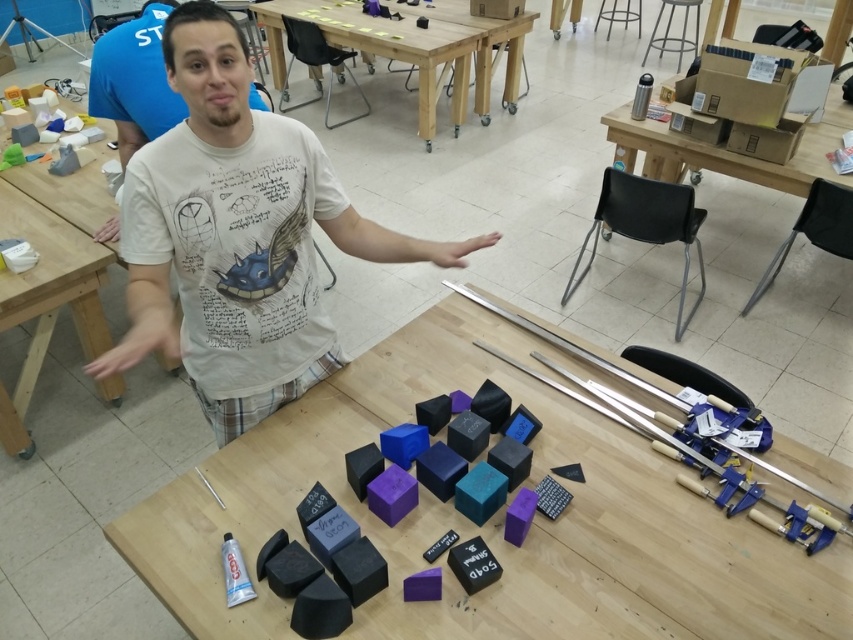
You are standing at the entrance of the workshop and see two points marked in the scene. The first point is at coordinate point [196,310] and the second is at coordinate point [18,218]. Which point is closer to you?

Point [196,310] is in front of point [18,218], so it is closer to you.

You are organizing a craft activity and need to place the matte plastic blocks at center onto the wooden table at left. Will the blocks fit vertically on the table without exceeding its height?

The matte plastic blocks at center are shorter than the wooden table at left, so they can be placed vertically on the table without exceeding its height.